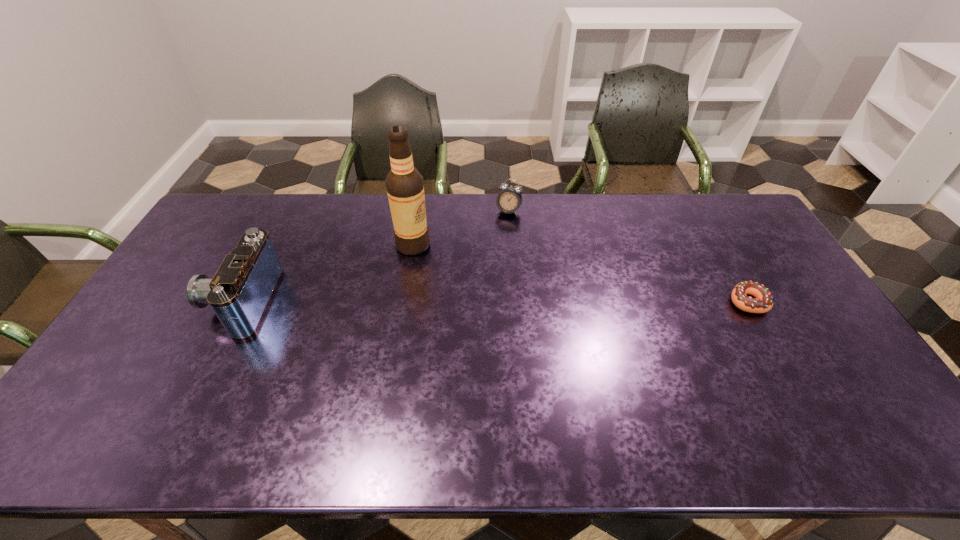
Find the location of a particular element. free location at the near left corner of the desktop is located at coordinates (108, 388).

The height and width of the screenshot is (540, 960). I want to click on blank space at the far right corner of the desktop, so click(x=729, y=218).

The width and height of the screenshot is (960, 540). Identify the location of vacant space in between the rightmost object and the alcohol. (580, 273).

At what (x,y) coordinates should I click in order to perform the action: click on free space between the second tallest object and the alcohol. Please return your answer as a coordinate pair (x, y). This screenshot has width=960, height=540. Looking at the image, I should click on (327, 273).

The width and height of the screenshot is (960, 540). In order to click on free point between the third tallest object and the shortest object in this screenshot , I will do `click(628, 256)`.

The height and width of the screenshot is (540, 960). Identify the location of free spot between the camcorder and the alcohol. (327, 273).

This screenshot has height=540, width=960. Find the location of `vacant area that lies between the shortest object and the second tallest object`. vacant area that lies between the shortest object and the second tallest object is located at coordinates (494, 301).

Locate an element on the screen. The height and width of the screenshot is (540, 960). vacant area that lies between the third nearest object and the rightmost object is located at coordinates (580, 273).

Identify the location of vacant area that lies between the second farthest object and the farthest object. Image resolution: width=960 pixels, height=540 pixels. (461, 228).

What are the coordinates of `vacant area between the doughnut and the alcohol` in the screenshot? It's located at (580, 273).